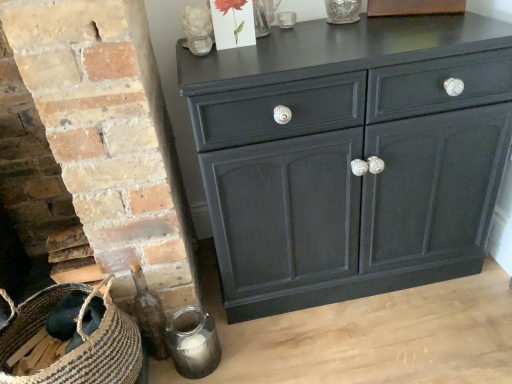
Question: Is brown woven basket at lower left not near translucent glass flower at upper center, which is the 2th flower from right to left?

Choices:
 (A) yes
 (B) no

Answer: (B)

Question: Does brown woven basket at lower left appear on the left side of translucent glass flower at upper center, which is the 2th flower from right to left?

Choices:
 (A) no
 (B) yes

Answer: (B)

Question: Is brown woven basket at lower left facing away from translucent glass flower at upper center, which is the 2th flower from right to left?

Choices:
 (A) no
 (B) yes

Answer: (A)

Question: From a real-world perspective, is brown woven basket at lower left positioned under translucent glass flower at upper center, which is the 2th flower from right to left, based on gravity?

Choices:
 (A) no
 (B) yes

Answer: (B)

Question: Is brown woven basket at lower left beside translucent glass flower at upper center, which is the 2th flower from right to left?

Choices:
 (A) no
 (B) yes

Answer: (A)

Question: Looking at their shapes, would you say brown woven basket at lower left is wider or thinner than transparent glass vase at upper center?

Choices:
 (A) thin
 (B) wide

Answer: (B)

Question: Would you say brown woven basket at lower left is to the left or to the right of transparent glass vase at upper center in the picture?

Choices:
 (A) left
 (B) right

Answer: (A)

Question: Based on their sizes in the image, would you say brown woven basket at lower left is bigger or smaller than transparent glass vase at upper center?

Choices:
 (A) big
 (B) small

Answer: (A)

Question: Considering the positions of point (30, 357) and point (343, 21), is point (30, 357) closer or farther from the camera than point (343, 21)?

Choices:
 (A) closer
 (B) farther

Answer: (A)

Question: Relative to matte black cabinet at center, is translucent glass flower at upper center, which is the 2th flower from right to left, in front or behind?

Choices:
 (A) front
 (B) behind

Answer: (B)

Question: Considering the positions of point (206, 21) and point (253, 268), is point (206, 21) closer or farther from the camera than point (253, 268)?

Choices:
 (A) farther
 (B) closer

Answer: (B)

Question: From a real-world perspective, is translucent glass flower at upper center, which is the first flower from left to right, physically located above or below matte black cabinet at center?

Choices:
 (A) above
 (B) below

Answer: (A)

Question: Considering the positions of translucent glass flower at upper center, which is the 2th flower from right to left, and matte black cabinet at center in the image, is translucent glass flower at upper center, which is the 2th flower from right to left, taller or shorter than matte black cabinet at center?

Choices:
 (A) tall
 (B) short

Answer: (B)

Question: Is translucent glass flower at upper center, which is the 2th flower from right to left, wider or thinner than brown woven basket at lower left?

Choices:
 (A) wide
 (B) thin

Answer: (B)

Question: Is translucent glass flower at upper center, which is the first flower from left to right, taller or shorter than brown woven basket at lower left?

Choices:
 (A) tall
 (B) short

Answer: (B)